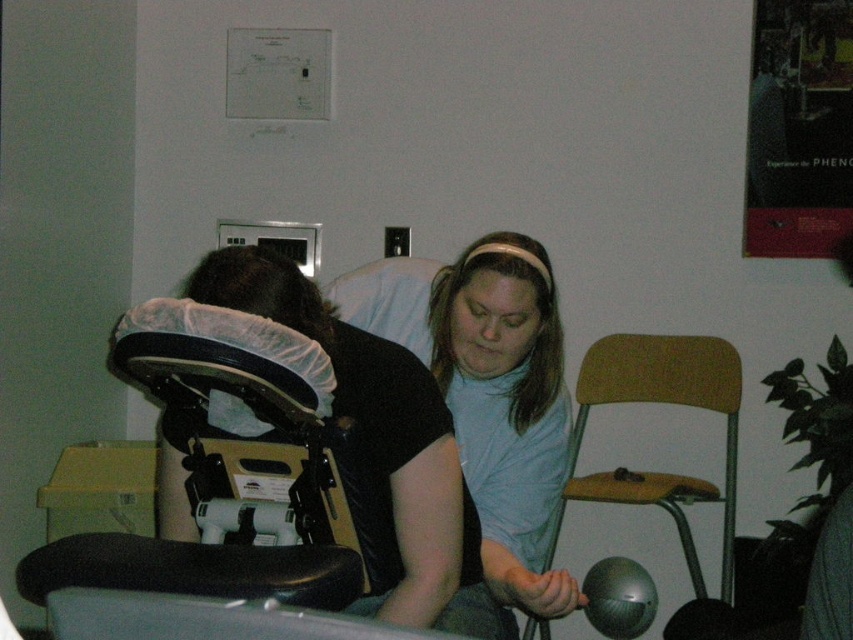
Who is shorter, black leather baby carriage at left or wooden swivel chair at center-right?

black leather baby carriage at left is shorter.

The image size is (853, 640). Describe the element at coordinates (251, 428) in the screenshot. I see `black leather baby carriage at left` at that location.

You are a GUI agent. You are given a task and a screenshot of the screen. Output one action in this format:
    pyautogui.click(x=<x>, y=<y>)
    Task: Click on the black leather baby carriage at left
    The width and height of the screenshot is (853, 640).
    Given the screenshot: What is the action you would take?
    pyautogui.click(x=251, y=428)

Who is taller, light blue fabric at center or black leather baby carriage at left?

With more height is light blue fabric at center.

Between light blue fabric at center and black leather baby carriage at left, which one has less height?

black leather baby carriage at left is shorter.

I want to click on light blue fabric at center, so (x=488, y=406).

Where is `light blue fabric at center`? light blue fabric at center is located at coordinates (488, 406).

Is black leather baby carriage at left shorter than matte black helmet at center?

Yes, black leather baby carriage at left is shorter than matte black helmet at center.

Does black leather baby carriage at left come behind matte black helmet at center?

No, black leather baby carriage at left is in front of matte black helmet at center.

The width and height of the screenshot is (853, 640). I want to click on black leather baby carriage at left, so [251, 428].